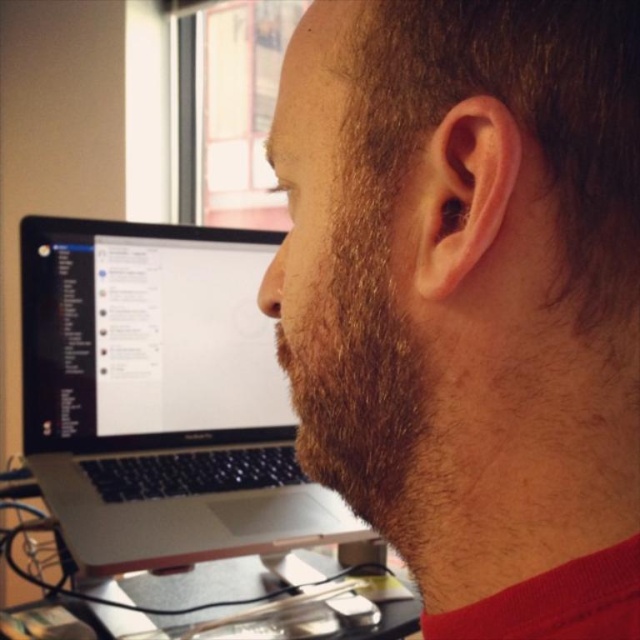
You are a photographer trying to capture a close portrait of the person in the scene. The metallic silver computer desk at lower center is reflecting light, causing glare. To avoid the glare, should you adjust your camera position to be above or below the dark brown beard at center?

The dark brown beard at center is positioned over the metallic silver computer desk at lower center. To avoid glare from the desk, you should position your camera above the dark brown beard at center so that the light reflecting off the desk is not directly in the camera lens.

You are a photographer trying to capture a portrait of the person in the scene. You want to ensure that both the dark brown beard at center and the silver metallic laptop at left are visible in the frame. Based on their positions, which object should be placed closer to the left side of your camera viewfinder?

The silver metallic laptop at left should be placed closer to the left side of the camera viewfinder because it is positioned to the left of the dark brown beard at center.

You are trying to determine the relative positions of two points in the image. Given that you are looking at the scene from the front, which point is closer to you, point [260,486] or point [1,502]?

Point [260,486] is closer to the viewer than point [1,502].